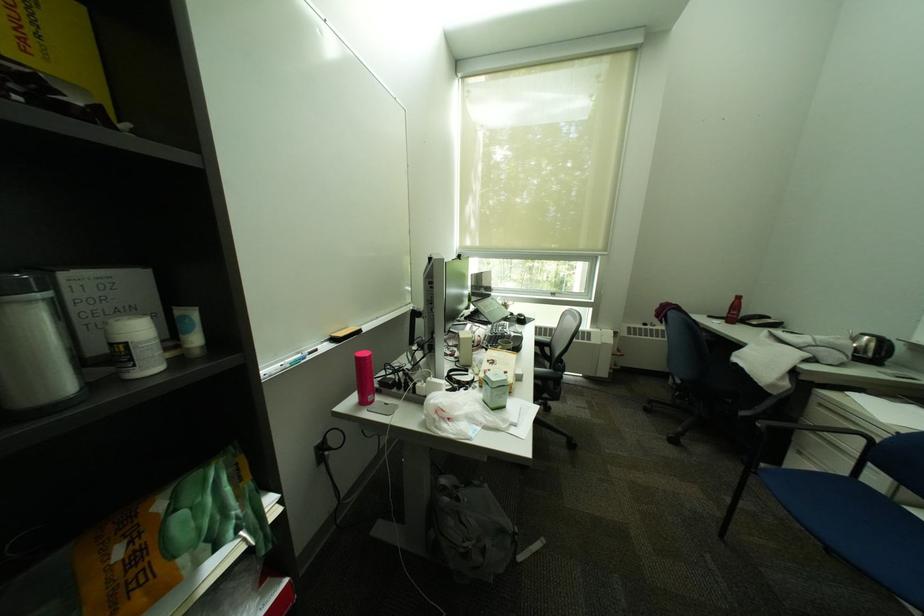
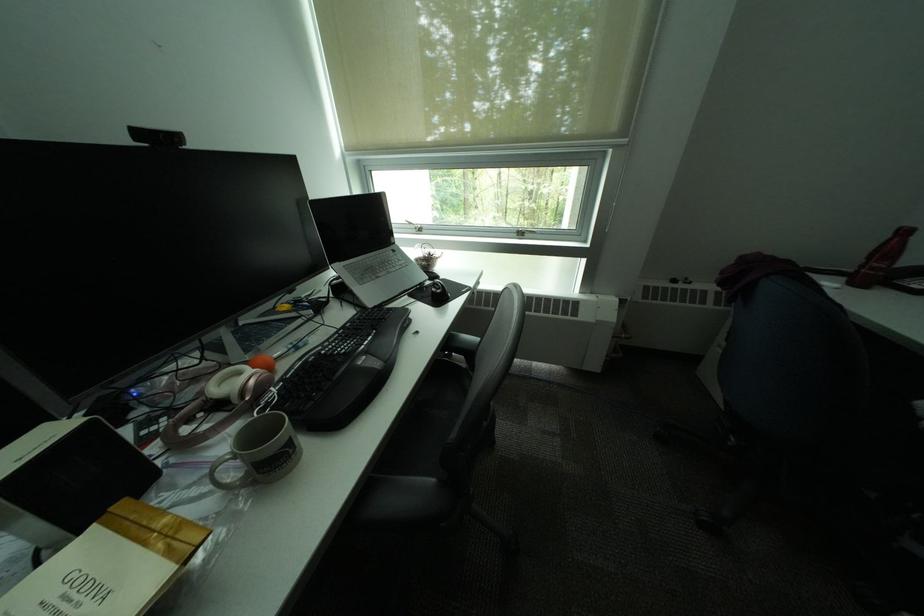
In a continuous first-person perspective shot, in which direction is the camera moving?

The cameraman walked toward right, forward.